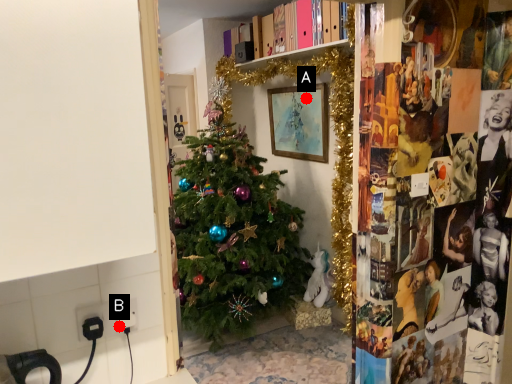
Question: Two points are circled on the image, labeled by A and B beside each circle. Which of the following is the farthest from the observer?

Choices:
 (A) A is further
 (B) B is further

Answer: (A)